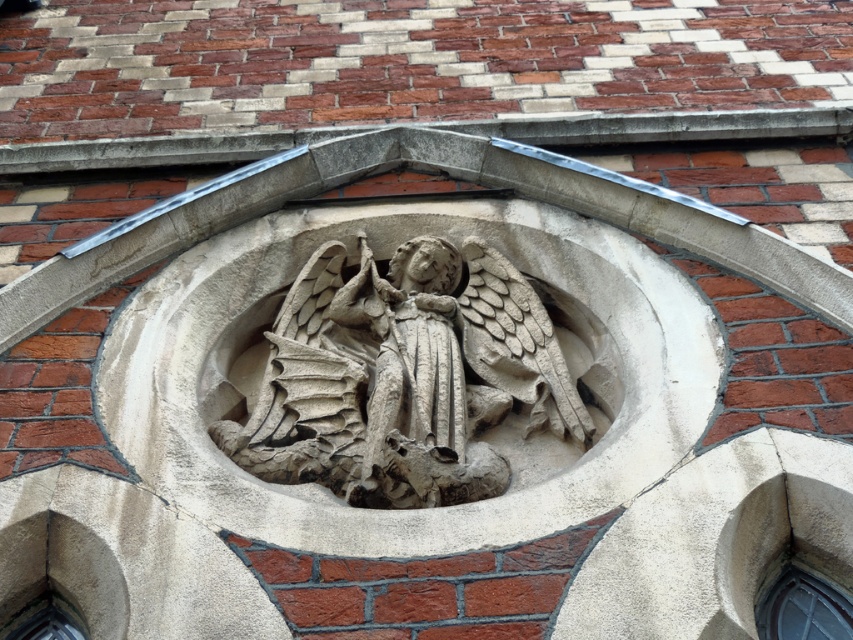
Can you confirm if gray stone angel at center is positioned above transparent glass window at lower left?

Yes, gray stone angel at center is above transparent glass window at lower left.

Which is more to the right, gray stone angel at center or transparent glass window at lower left?

gray stone angel at center is more to the right.

What do you see at coordinates (404, 376) in the screenshot?
I see `gray stone angel at center` at bounding box center [404, 376].

Find the location of a particular element. gray stone angel at center is located at coordinates (404, 376).

Does gray stone angel at center appear on the left side of clear glass window at lower right?

Yes, gray stone angel at center is to the left of clear glass window at lower right.

Who is higher up, gray stone angel at center or clear glass window at lower right?

gray stone angel at center is above.

The height and width of the screenshot is (640, 853). What do you see at coordinates (404, 376) in the screenshot?
I see `gray stone angel at center` at bounding box center [404, 376].

I want to click on gray stone angel at center, so click(x=404, y=376).

You are a GUI agent. You are given a task and a screenshot of the screen. Output one action in this format:
    pyautogui.click(x=<x>, y=<y>)
    Task: Click on the clear glass window at lower right
    
    Given the screenshot: What is the action you would take?
    pyautogui.click(x=802, y=605)

Does clear glass window at lower right appear under transparent glass window at lower left?

Actually, clear glass window at lower right is above transparent glass window at lower left.

Is point (776, 580) farther from viewer compared to point (42, 602)?

Yes.

Find the location of `clear glass window at lower right`. clear glass window at lower right is located at coordinates (802, 605).